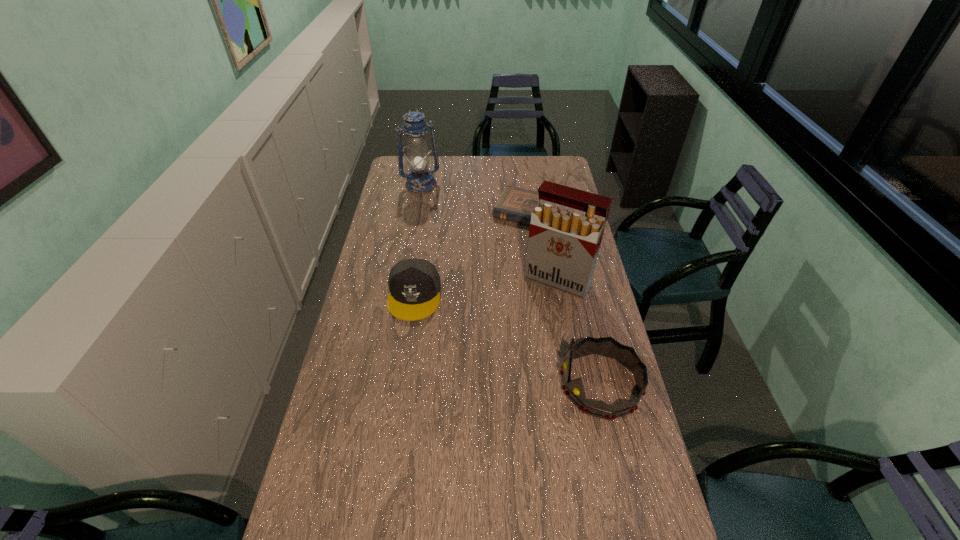
Image resolution: width=960 pixels, height=540 pixels. Find the location of `object situated at the far edge`. object situated at the far edge is located at coordinates (419, 180).

Locate an element on the screen. cap that is at the left edge is located at coordinates 414,284.

In order to click on lantern present at the left edge in this screenshot , I will do [x=419, y=180].

The image size is (960, 540). What are the coordinates of `tiara located at the right edge` in the screenshot? It's located at (574, 390).

You are a GUI agent. You are given a task and a screenshot of the screen. Output one action in this format:
    pyautogui.click(x=<x>, y=<y>)
    Task: Click on the cigarette case present at the right edge
    
    Given the screenshot: What is the action you would take?
    pyautogui.click(x=566, y=229)

Find the location of a particular element. The height and width of the screenshot is (540, 960). Bible positioned at the right edge is located at coordinates point(515,204).

Identify the location of object positioned at the far left corner. (419, 180).

Where is `vacant space at the far edge`? The image size is (960, 540). vacant space at the far edge is located at coordinates (x=535, y=178).

What are the coordinates of `vacant space at the near edge of the desktop` in the screenshot? It's located at (564, 531).

You are a GUI agent. You are given a task and a screenshot of the screen. Output one action in this format:
    pyautogui.click(x=<x>, y=<y>)
    Task: Click on the free space at the left edge of the desktop
    The height and width of the screenshot is (540, 960).
    Given the screenshot: What is the action you would take?
    pyautogui.click(x=369, y=255)